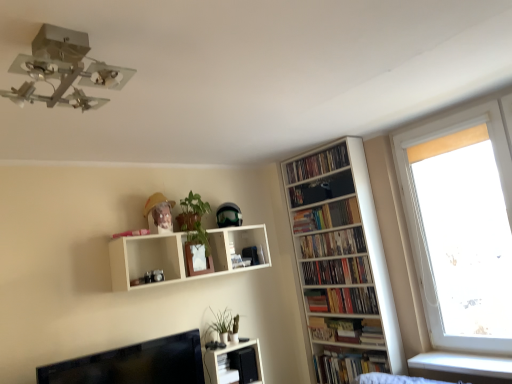
You are a GUI agent. You are given a task and a screenshot of the screen. Output one action in this format:
    pyautogui.click(x=<x>, y=<y>)
    Task: Click on the hardcover books at lower right, which is counted as the 6th book, starting from the top
    Image resolution: width=512 pixels, height=384 pixels.
    Given the screenshot: What is the action you would take?
    pyautogui.click(x=348, y=365)

Measure the distance between point (182, 202) and camera.

Point (182, 202) and camera are 10.81 feet apart.

What do you see at coordinates (234, 364) in the screenshot? I see `white glossy shelf at lower center, the second shelf positioned from the top` at bounding box center [234, 364].

In order to face hardcover book at center-right, arranged as the second book when ordered from the bottom, should I rotate leftwards or rightwards?

It's best to rotate right around 13.182 degrees.

The image size is (512, 384). What do you see at coordinates (463, 364) in the screenshot?
I see `white foam window sill at lower right` at bounding box center [463, 364].

Locate an element on the screen. The width and height of the screenshot is (512, 384). hardcover books at center-right, placed as the 4th book when sorted from bottom to top is located at coordinates (333, 243).

Between hardcover book at center-right, positioned as the fifth book in top-to-bottom order, and black glossy monitor at lower left, which one has less height?

hardcover book at center-right, positioned as the fifth book in top-to-bottom order, is shorter.

Is hardcover book at center-right, positioned as the fifth book in top-to-bottom order, to the left or to the right of black glossy monitor at lower left in the image?

Based on their positions, hardcover book at center-right, positioned as the fifth book in top-to-bottom order, is located to the right of black glossy monitor at lower left.

From the image's perspective, which is below, hardcover book at center-right, arranged as the second book when ordered from the bottom, or black glossy monitor at lower left?

black glossy monitor at lower left appears lower in the image.

Between point (361, 295) and point (170, 377), which one is positioned in front?

The point (170, 377) is in front.

Between green matte plant at upper center, arranged as the first plant when viewed from the top, and hardcover books at center-right, placed as the 4th book when sorted from bottom to top, which one has larger width?

green matte plant at upper center, arranged as the first plant when viewed from the top, is wider.

Are green matte plant at upper center, placed as the 2th plant when sorted from bottom to top, and hardcover books at center-right, placed as the 4th book when sorted from bottom to top, far apart?

Absolutely, green matte plant at upper center, placed as the 2th plant when sorted from bottom to top, is distant from hardcover books at center-right, placed as the 4th book when sorted from bottom to top.

Does green matte plant at upper center, arranged as the first plant when viewed from the top, lie behind hardcover books at center-right, positioned as the third book in top-to-bottom order?

No, green matte plant at upper center, arranged as the first plant when viewed from the top, is in front of hardcover books at center-right, positioned as the third book in top-to-bottom order.

Between green matte plant at upper center, arranged as the first plant when viewed from the top, and hardcover books at center-right, placed as the 4th book when sorted from bottom to top, which one has larger size?

green matte plant at upper center, arranged as the first plant when viewed from the top, is bigger.

Is transparent glass window at upper right bigger or smaller than hardcover books at lower right, which is the 1th book in bottom-to-top order?

In the image, transparent glass window at upper right appears to be larger than hardcover books at lower right, which is the 1th book in bottom-to-top order.

Considering the positions of objects transparent glass window at upper right and hardcover books at lower right, which is counted as the 6th book, starting from the top, in the image provided, who is more to the right, transparent glass window at upper right or hardcover books at lower right, which is counted as the 6th book, starting from the top,?

Positioned to the right is transparent glass window at upper right.

Looking at this image, looking at their sizes, would you say transparent glass window at upper right is wider or thinner than hardcover books at lower right, which is counted as the 6th book, starting from the top?

Considering their sizes, transparent glass window at upper right looks slimmer than hardcover books at lower right, which is counted as the 6th book, starting from the top.

Are white matte shelf at upper center, which is counted as the 1th shelf, starting from the top, and green matte plant at center, the second plant in the top-to-bottom sequence, located far from each other?

No, white matte shelf at upper center, which is counted as the 1th shelf, starting from the top, is not far away from green matte plant at center, the second plant in the top-to-bottom sequence.

Can you confirm if white matte shelf at upper center, the 2th shelf in the bottom-to-top sequence, is shorter than green matte plant at center, the 1th plant from the bottom?

No, white matte shelf at upper center, the 2th shelf in the bottom-to-top sequence, is not shorter than green matte plant at center, the 1th plant from the bottom.

Which is more to the left, white matte shelf at upper center, the 2th shelf in the bottom-to-top sequence, or green matte plant at center, the second plant in the top-to-bottom sequence?

Positioned to the left is white matte shelf at upper center, the 2th shelf in the bottom-to-top sequence.

Identify the location of shelf above the green matte plant at center, the second plant in the top-to-bottom sequence (from a real-world perspective). The width and height of the screenshot is (512, 384). (182, 255).

Which object is further away from the camera taking this photo, white matte shelf at upper center, which is counted as the 1th shelf, starting from the top, or hardcover books at lower right, which is the 1th book in bottom-to-top order?

hardcover books at lower right, which is the 1th book in bottom-to-top order, is further away from the camera.

How far apart are white matte shelf at upper center, which is counted as the 1th shelf, starting from the top, and hardcover books at lower right, which is the 1th book in bottom-to-top order?

white matte shelf at upper center, which is counted as the 1th shelf, starting from the top, is 5.14 feet from hardcover books at lower right, which is the 1th book in bottom-to-top order.

From a real-world perspective, does white matte shelf at upper center, the 2th shelf in the bottom-to-top sequence, stand above hardcover books at lower right, which is the 1th book in bottom-to-top order?

Yes, from a real-world perspective, white matte shelf at upper center, the 2th shelf in the bottom-to-top sequence, is above hardcover books at lower right, which is the 1th book in bottom-to-top order.

Is white matte shelf at upper center, the 2th shelf in the bottom-to-top sequence, looking in the opposite direction of hardcover books at lower right, which is counted as the 6th book, starting from the top?

white matte shelf at upper center, the 2th shelf in the bottom-to-top sequence, is not turned away from hardcover books at lower right, which is counted as the 6th book, starting from the top.

Between wooden shelf at upper right, which is counted as the first book, starting from the top, and white wooden bookcase at right, which one has less height?

wooden shelf at upper right, which is counted as the first book, starting from the top, is shorter.

Which object is positioned more to the left, wooden shelf at upper right, which is counted as the first book, starting from the top, or white wooden bookcase at right?

From the viewer's perspective, wooden shelf at upper right, which is counted as the first book, starting from the top, appears more on the left side.

Can you tell me how much wooden shelf at upper right, which is counted as the first book, starting from the top, and white wooden bookcase at right differ in facing direction?

They differ by 0.000767 degrees in their facing directions.

Who is more distant, metallic chrome light fixture at upper left or hardcover books at center-right, placed as the 4th book when sorted from bottom to top?

hardcover books at center-right, placed as the 4th book when sorted from bottom to top, is further away from the camera.

How many degrees apart are the facing directions of metallic chrome light fixture at upper left and hardcover books at center-right, positioned as the third book in top-to-bottom order?

They differ by 3.91 degrees in their facing directions.

Who is taller, metallic chrome light fixture at upper left or hardcover books at center-right, positioned as the third book in top-to-bottom order?

metallic chrome light fixture at upper left is taller.

Is metallic chrome light fixture at upper left completely or partially outside of hardcover books at center-right, positioned as the third book in top-to-bottom order?

Absolutely, metallic chrome light fixture at upper left is external to hardcover books at center-right, positioned as the third book in top-to-bottom order.

I want to click on the 2nd book behind the black glossy monitor at lower left, so click(x=343, y=300).

There is a green matte plant at upper center, placed as the 2th plant when sorted from bottom to top. Identify the location of the 2nd book below it (from a real-world perspective). The image size is (512, 384). (333, 243).

Looking at the image, which one is located closer to white matte shelf at upper center, which is counted as the 1th shelf, starting from the top, wooden shelf at upper right, positioned as the sixth book in bottom-to-top order, or white foam window sill at lower right?

wooden shelf at upper right, positioned as the sixth book in bottom-to-top order, is closer to white matte shelf at upper center, which is counted as the 1th shelf, starting from the top.

Looking at the image, which one is located further to wooden shelf at upper right, which is counted as the first book, starting from the top, hardcover books at right, positioned as the third book in bottom-to-top order, or white foam window sill at lower right?

The object further to wooden shelf at upper right, which is counted as the first book, starting from the top, is white foam window sill at lower right.

Looking at the image, which one is located further to hardcover books at center-right, placed as the 4th book when sorted from bottom to top, green matte plant at upper center, arranged as the first plant when viewed from the top, or hardcover books at upper right, acting as the 2th book starting from the top?

Based on the image, green matte plant at upper center, arranged as the first plant when viewed from the top, appears to be further to hardcover books at center-right, placed as the 4th book when sorted from bottom to top.

Looking at the image, which one is located closer to white glossy shelf at lower center, which appears as the first shelf when ordered from the bottom, black glossy monitor at lower left or hardcover book at center-right, arranged as the second book when ordered from the bottom?

black glossy monitor at lower left is closer to white glossy shelf at lower center, which appears as the first shelf when ordered from the bottom.

Which object lies further to the anchor point wooden shelf at upper right, which is counted as the first book, starting from the top, green matte plant at center, the 1th plant from the bottom, or black glossy monitor at lower left?

black glossy monitor at lower left lies further to wooden shelf at upper right, which is counted as the first book, starting from the top, than the other object.

From the image, which object appears to be farther from wooden shelf at upper right, which is counted as the first book, starting from the top, transparent glass window at upper right or hardcover books at center-right, positioned as the third book in top-to-bottom order?

transparent glass window at upper right lies further to wooden shelf at upper right, which is counted as the first book, starting from the top, than the other object.

Looking at the image, which one is located further to green matte plant at upper center, placed as the 2th plant when sorted from bottom to top, white wooden bookcase at right or white matte shelf at upper center, the 2th shelf in the bottom-to-top sequence?

Based on the image, white wooden bookcase at right appears to be further to green matte plant at upper center, placed as the 2th plant when sorted from bottom to top.

Based on their spatial positions, is black glossy monitor at lower left or hardcover books at upper right, placed as the fifth book when sorted from bottom to top, closer to green matte plant at upper center, arranged as the first plant when viewed from the top?

black glossy monitor at lower left.

At what (x,y) coordinates should I click in order to perform the action: click on bookcase located between white glossy shelf at lower center, the second shelf positioned from the top, and hardcover books at lower right, which is counted as the 6th book, starting from the top, in the left-right direction. Please return your answer as a coordinate pair (x, y). Image resolution: width=512 pixels, height=384 pixels. Looking at the image, I should click on point(342,263).

Where is `window sill between wooden shelf at upper right, positioned as the sixth book in bottom-to-top order, and white glossy shelf at lower center, the second shelf positioned from the top, from top to bottom`? The height and width of the screenshot is (384, 512). window sill between wooden shelf at upper right, positioned as the sixth book in bottom-to-top order, and white glossy shelf at lower center, the second shelf positioned from the top, from top to bottom is located at coordinates pyautogui.click(x=463, y=364).

Locate an element on the screen. shelf that lies between wooden shelf at upper right, positioned as the sixth book in bottom-to-top order, and white glossy shelf at lower center, which appears as the first shelf when ordered from the bottom, from top to bottom is located at coordinates (182, 255).

Identify the location of light fixture between black glossy monitor at lower left and transparent glass window at upper right from left to right. (64, 70).